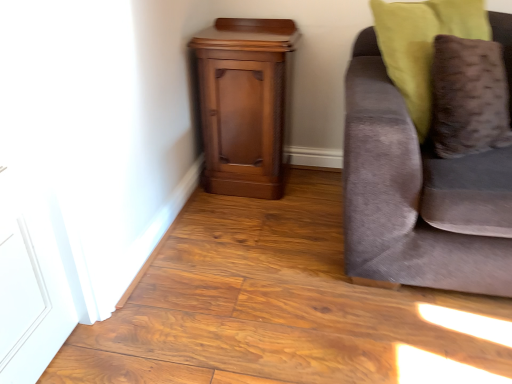
What are the coordinates of `vacant space in between polished wood nightstand at lower left and velvet gray couch at right` in the screenshot? It's located at (284, 221).